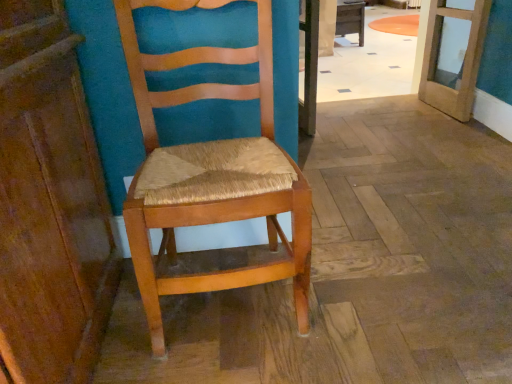
Question: Considering the positions of point (437, 44) and point (354, 4), is point (437, 44) closer or farther from the camera than point (354, 4)?

Choices:
 (A) farther
 (B) closer

Answer: (B)

Question: Is wooden door at upper right bigger or smaller than wooden table at center?

Choices:
 (A) small
 (B) big

Answer: (A)

Question: Based on their relative distances, which object is farther from the wooden table at center?

Choices:
 (A) wooden woven seat at center
 (B) wooden door at upper right

Answer: (A)

Question: Which of these objects is positioned closest to the wooden table at center?

Choices:
 (A) wooden door at upper right
 (B) wooden woven seat at center

Answer: (A)